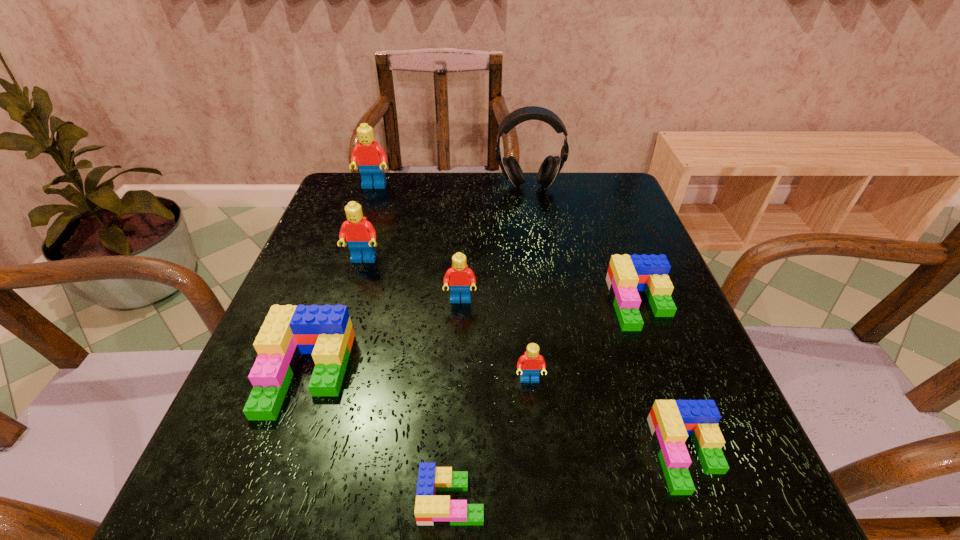
Find the location of a particular element. This screenshot has width=960, height=540. vacant position at the far edge of the desktop is located at coordinates (412, 185).

I want to click on vacant space at the near edge of the desktop, so click(476, 504).

Identify the location of blank area at the left edge. (336, 227).

This screenshot has height=540, width=960. I want to click on vacant region at the right edge, so click(x=688, y=316).

At what (x,y) coordinates should I click in order to perform the action: click on free space at the far right corner. Please return your answer as a coordinate pair (x, y). Looking at the image, I should click on (625, 205).

Identify the location of unoccupied area between the farthest green Lego and the smallest green Lego. This screenshot has width=960, height=540. (546, 402).

Identify the location of free spot between the smallest green Lego and the farthest red Lego. The height and width of the screenshot is (540, 960). (413, 343).

Identify the location of vacant space in between the tallest object and the biggest red Lego. The height and width of the screenshot is (540, 960). (451, 186).

This screenshot has width=960, height=540. I want to click on vacant space that's between the earphone and the smallest red Lego, so click(x=529, y=284).

Locate an element on the screen. The width and height of the screenshot is (960, 540). vacant region between the second biggest green Lego and the shortest Lego is located at coordinates (546, 402).